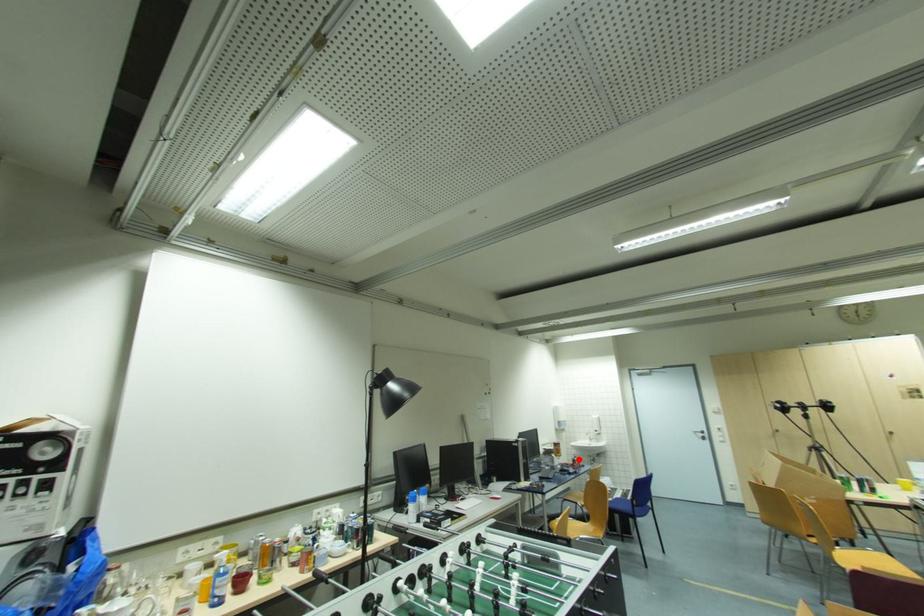
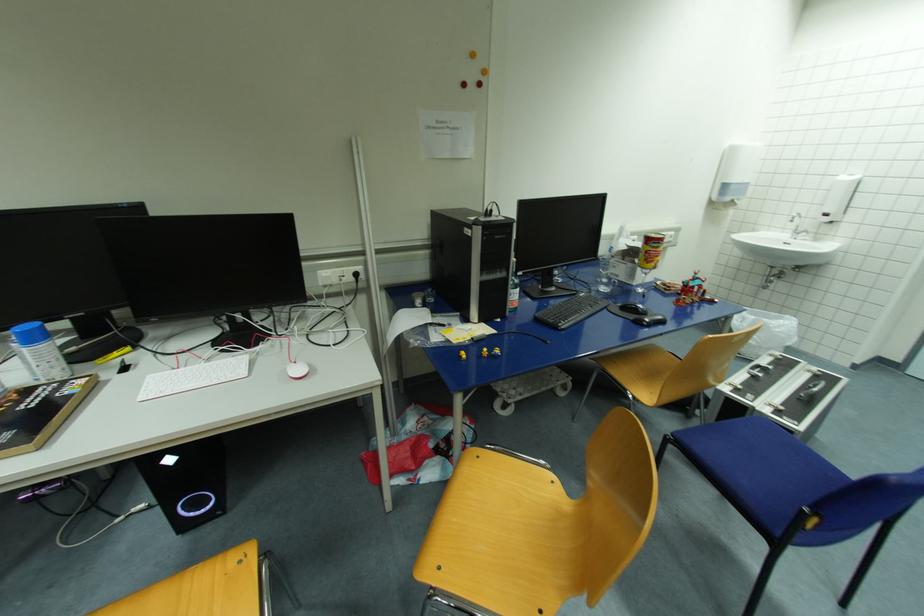
Where in the second image is the point corresponding to the highlighted location from the first image?

(696, 285)